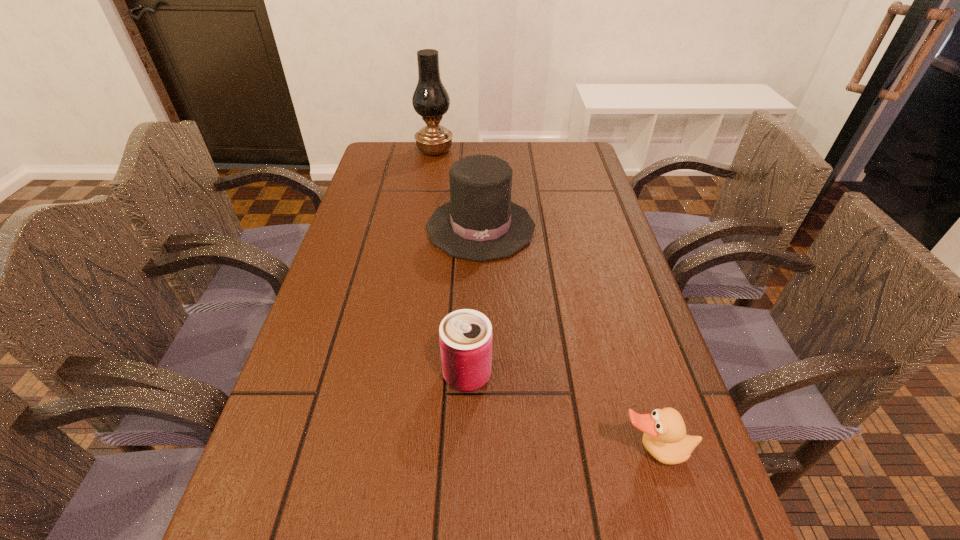
The height and width of the screenshot is (540, 960). I want to click on vacant space located 0.090m on the right of the third farthest object, so click(539, 375).

Locate an element on the screen. Image resolution: width=960 pixels, height=540 pixels. free space located on the beak of the shortest object is located at coordinates (675, 523).

You are a GUI agent. You are given a task and a screenshot of the screen. Output one action in this format:
    pyautogui.click(x=<x>, y=<y>)
    Task: Click on the object that is at the far edge
    The width and height of the screenshot is (960, 540).
    Given the screenshot: What is the action you would take?
    pyautogui.click(x=430, y=100)

The image size is (960, 540). I want to click on object situated at the left edge, so click(430, 100).

The width and height of the screenshot is (960, 540). I want to click on object situated at the right edge, so click(665, 438).

The height and width of the screenshot is (540, 960). I want to click on object present at the far left corner, so click(430, 100).

The image size is (960, 540). Find the location of `vacant point at the far edge`. vacant point at the far edge is located at coordinates (446, 171).

Find the location of `vacant area at the left edge of the desktop`. vacant area at the left edge of the desktop is located at coordinates (377, 252).

Image resolution: width=960 pixels, height=540 pixels. In order to click on vacant region at the right edge in this screenshot , I will do `click(612, 266)`.

In the image, there is a desktop. Where is `vacant space at the far right corner`? vacant space at the far right corner is located at coordinates [587, 145].